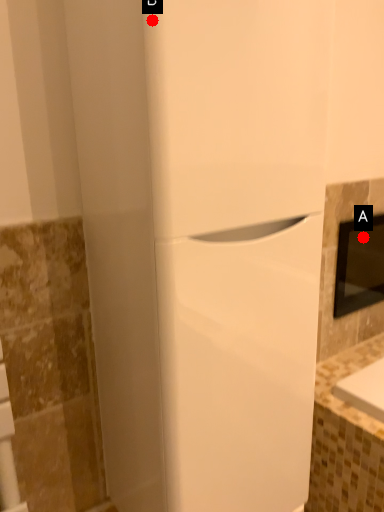
Question: Two points are circled on the image, labeled by A and B beside each circle. Which point is farther to the camera?

Choices:
 (A) A is further
 (B) B is further

Answer: (A)